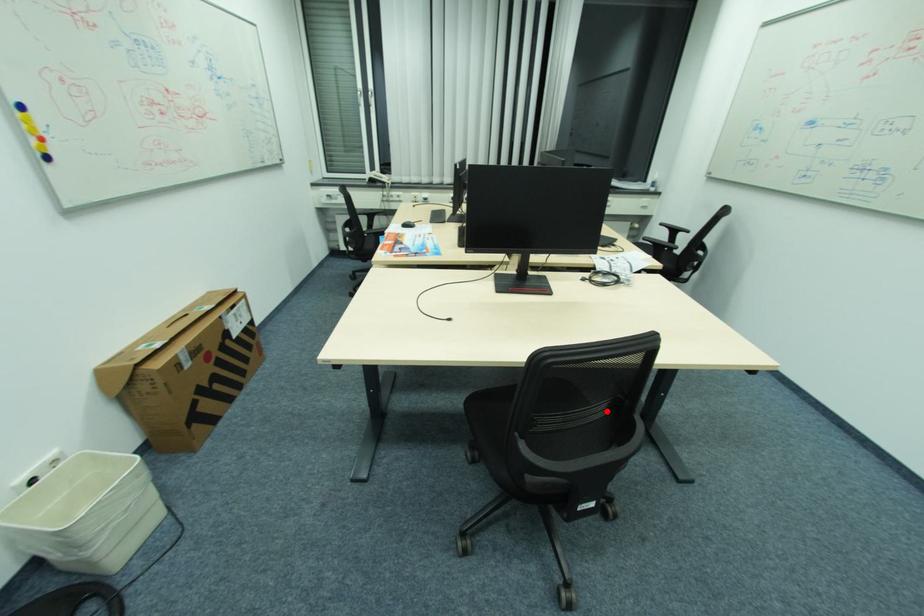
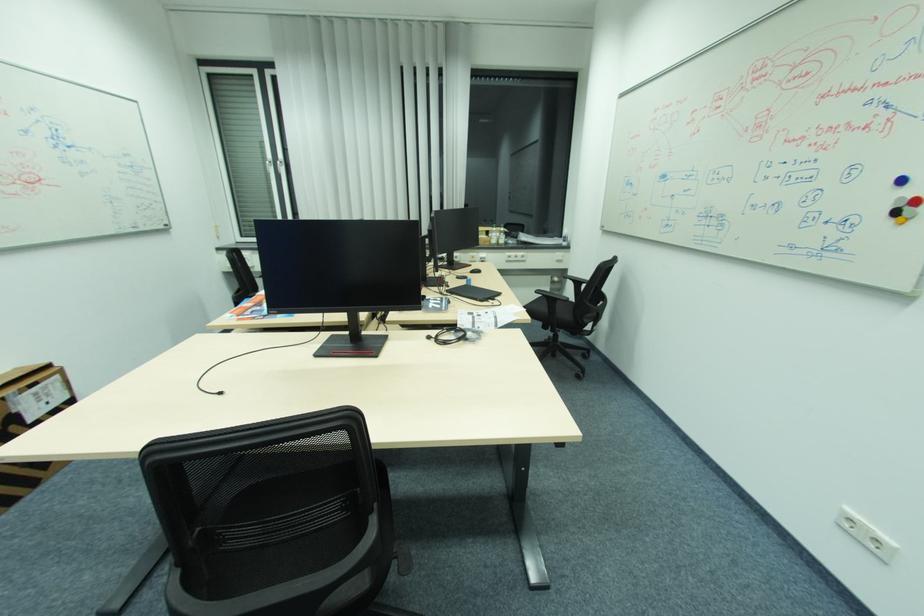
Question: I am providing you with two images of the same scene from different viewpoints. Given a red point in image1, look at the same physical point in image2. Is it:

Choices:
 (A) Closer to the viewpoint
 (B) Farther from the viewpoint

Answer: (B)